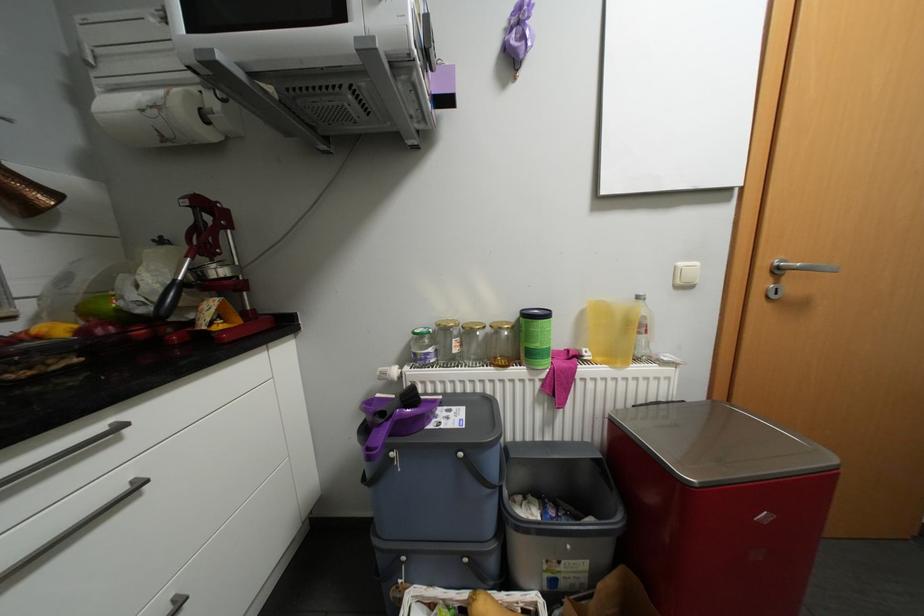
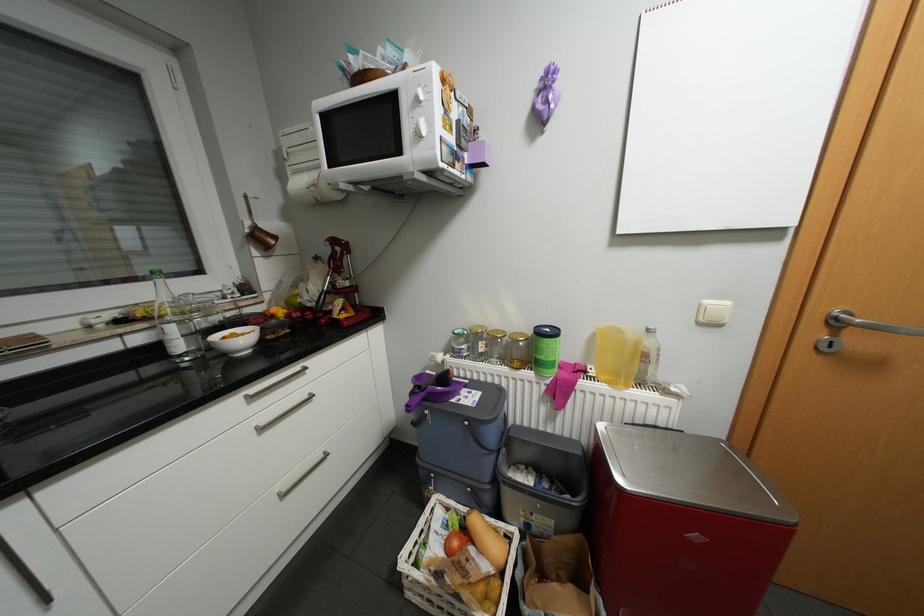
In the second image, find the point that corresponds to (685,286) in the first image.

(708, 323)